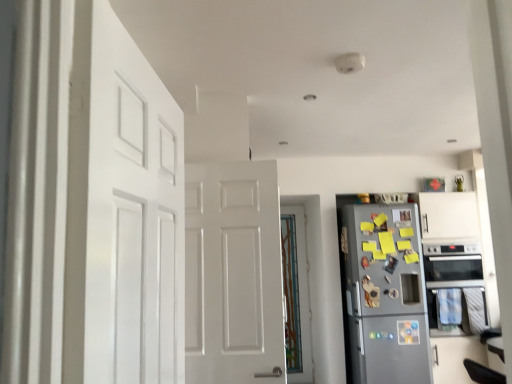
Question: Is black glass oven at right positioned beyond the bounds of metallic gray refrigerator at right?

Choices:
 (A) no
 (B) yes

Answer: (B)

Question: Considering the relative positions of black glass oven at right and metallic gray refrigerator at right in the image provided, is black glass oven at right to the left of metallic gray refrigerator at right from the viewer's perspective?

Choices:
 (A) yes
 (B) no

Answer: (B)

Question: Can you confirm if black glass oven at right is positioned to the right of metallic gray refrigerator at right?

Choices:
 (A) no
 (B) yes

Answer: (B)

Question: Is black glass oven at right shorter than metallic gray refrigerator at right?

Choices:
 (A) yes
 (B) no

Answer: (A)

Question: From the image's perspective, is black glass oven at right located above metallic gray refrigerator at right?

Choices:
 (A) yes
 (B) no

Answer: (A)

Question: Is point (358, 324) positioned closer to the camera than point (155, 364)?

Choices:
 (A) closer
 (B) farther

Answer: (B)

Question: Based on their positions, is metallic gray refrigerator at right located to the left or right of white matte door at left, placed as the second door when sorted from back to front?

Choices:
 (A) right
 (B) left

Answer: (A)

Question: From the image's perspective, is metallic gray refrigerator at right positioned above or below white matte door at left, placed as the first door when sorted from left to right?

Choices:
 (A) above
 (B) below

Answer: (B)

Question: From a real-world perspective, relative to white matte door at left, the first door in the front-to-back sequence, is metallic gray refrigerator at right vertically above or below?

Choices:
 (A) above
 (B) below

Answer: (B)

Question: Considering the positions of black glass oven at right and translucent glass door at center, the 1th door viewed from the back, in the image, is black glass oven at right taller or shorter than translucent glass door at center, the 1th door viewed from the back,?

Choices:
 (A) short
 (B) tall

Answer: (A)

Question: From the image's perspective, is black glass oven at right above or below translucent glass door at center, marked as the second door in a front-to-back arrangement?

Choices:
 (A) below
 (B) above

Answer: (B)

Question: Relative to translucent glass door at center, the 1th door viewed from the back, is black glass oven at right in front or behind?

Choices:
 (A) behind
 (B) front

Answer: (B)

Question: Is black glass oven at right inside or outside of translucent glass door at center, the 1th door viewed from the back?

Choices:
 (A) outside
 (B) inside

Answer: (A)

Question: From a real-world perspective, is white matte door at left, the second door positioned from the right, physically located above or below metallic gray refrigerator at right?

Choices:
 (A) above
 (B) below

Answer: (A)

Question: Is white matte door at left, the first door in the front-to-back sequence, inside the boundaries of metallic gray refrigerator at right, or outside?

Choices:
 (A) outside
 (B) inside

Answer: (A)